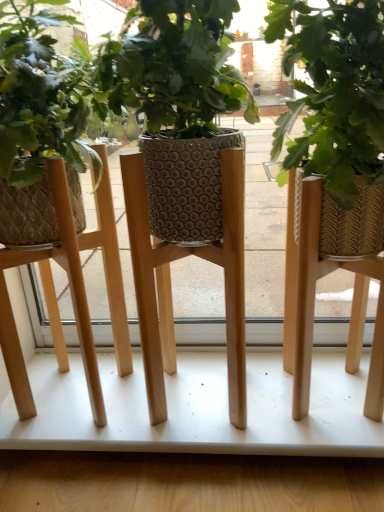
At what (x,y) coordinates should I click in order to perform the action: click on vacant region below woven straw planter at center (from a real-world perspective). Please return your answer as a coordinate pair (x, y). The image size is (384, 512). Looking at the image, I should click on [312, 408].